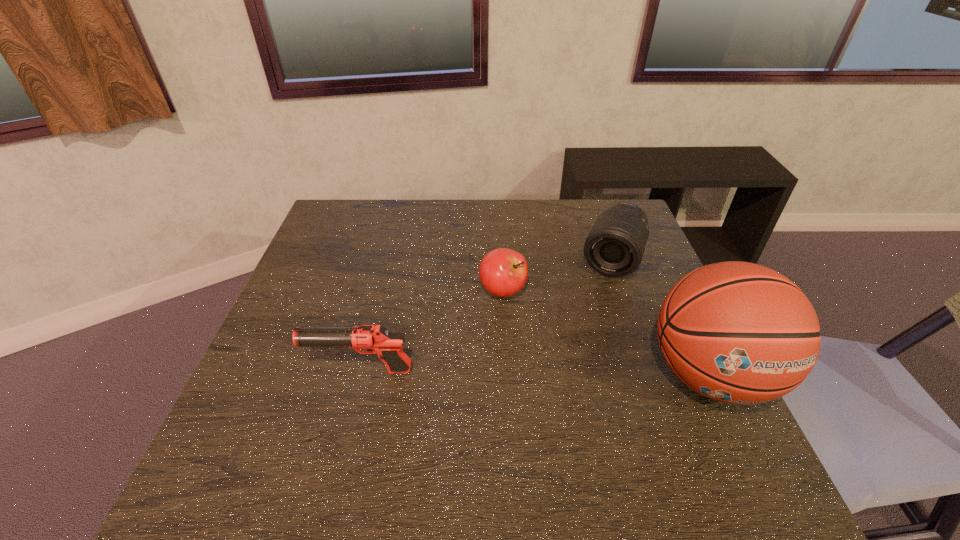
In order to click on the leftmost object in this screenshot , I will do `click(377, 339)`.

I want to click on the tallest object, so pyautogui.click(x=740, y=333).

Identify the location of the second object from left to right. The height and width of the screenshot is (540, 960). (503, 272).

This screenshot has height=540, width=960. I want to click on telephoto lens, so click(615, 246).

Identify the location of free space located at the aiming end of the leftmost object. The image size is (960, 540). (259, 371).

The image size is (960, 540). Identify the location of free space located on the stem of the apple. (537, 385).

Locate an element on the screen. The width and height of the screenshot is (960, 540). vacant space located on the stem of the apple is located at coordinates (526, 356).

Where is `vacant area located 0.270m on the stem of the apple`? This screenshot has width=960, height=540. vacant area located 0.270m on the stem of the apple is located at coordinates (540, 396).

Where is `free space located 0.170m on the surface of the telephoto lens`? free space located 0.170m on the surface of the telephoto lens is located at coordinates (588, 324).

At what (x,y) coordinates should I click in order to perform the action: click on free space located on the surface of the telephoto lens. Please return your answer as a coordinate pair (x, y). This screenshot has width=960, height=540. Looking at the image, I should click on (596, 303).